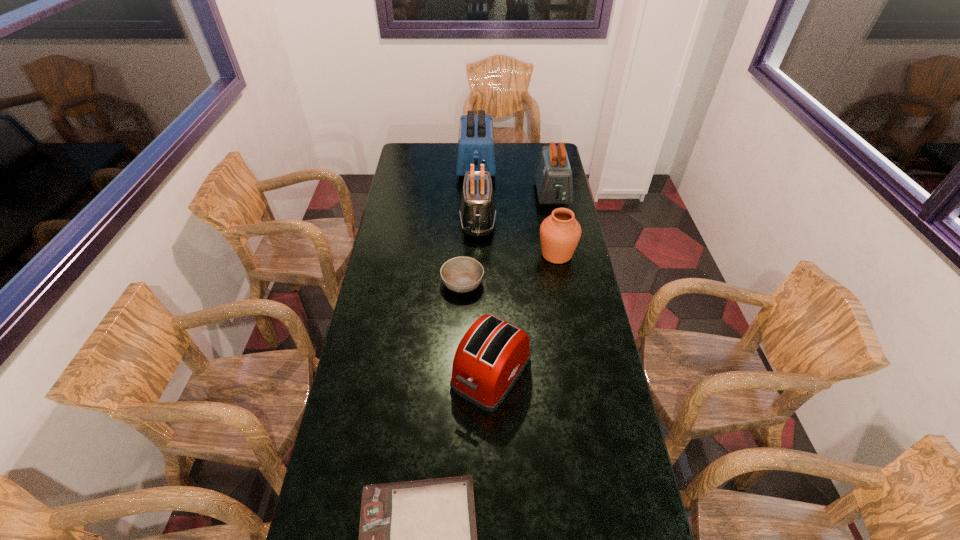
Where is `the rightmost toaster`? the rightmost toaster is located at coordinates (553, 176).

What are the coordinates of `urn` in the screenshot? It's located at (560, 232).

Locate an element on the screen. This screenshot has height=540, width=960. the nearest toaster is located at coordinates [x=491, y=356].

Where is `the second nearest object`? the second nearest object is located at coordinates (491, 356).

In order to click on bowl in this screenshot , I will do `click(461, 274)`.

Find the location of a particular element. the third nearest object is located at coordinates (461, 274).

Locate an element on the screen. free space located on the front-facing side of the rightmost toaster is located at coordinates (558, 222).

Identify the location of blank area located 0.060m on the front of the urn. (561, 279).

Locate an element on the screen. vacant position located on the right of the nearest toaster is located at coordinates (612, 373).

The height and width of the screenshot is (540, 960). What are the coordinates of `blank space located on the right of the bowl` in the screenshot? It's located at (530, 283).